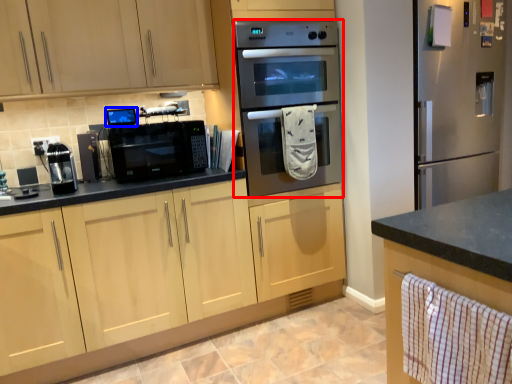
Question: Which object is further to the camera taking this photo, microwave oven (highlighted by a red box) or appliance (highlighted by a blue box)?

Choices:
 (A) microwave oven
 (B) appliance

Answer: (B)